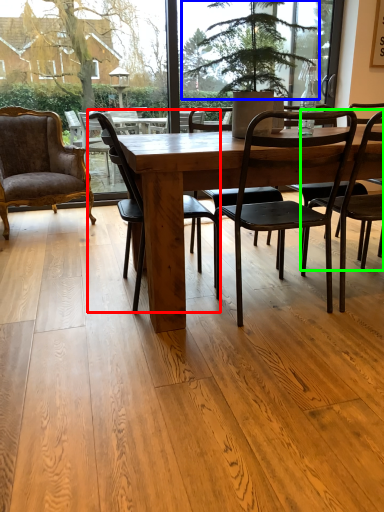
Question: Considering the real-world distances, which object is closest to chair (highlighted by a red box)? tree (highlighted by a blue box) or chair (highlighted by a green box).

Choices:
 (A) tree
 (B) chair

Answer: (B)